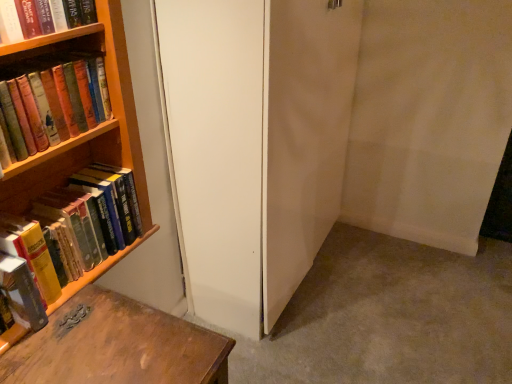
The width and height of the screenshot is (512, 384). What are the coordinates of `hardcover books at left, marked as the 3th book in a top-to-bottom arrangement` in the screenshot? It's located at (88, 215).

What do you see at coordinates (31, 19) in the screenshot? I see `hardcover book at upper left, which is the 4th book in bottom-to-top order` at bounding box center [31, 19].

What do you see at coordinates (55, 101) in the screenshot? This screenshot has width=512, height=384. I see `hardcover books at left, which appears as the 3th book when ordered from the bottom` at bounding box center [55, 101].

This screenshot has width=512, height=384. What are the coordinates of `white matte screen door at center` in the screenshot? It's located at (216, 152).

Image resolution: width=512 pixels, height=384 pixels. Describe the element at coordinates (216, 152) in the screenshot. I see `white matte screen door at center` at that location.

I want to click on hardcover book at left, positioned as the fourth book in top-to-bottom order, so click(22, 293).

Can you confirm if hardcover books at left, marked as the 2th book in a top-to-bottom arrangement, is smaller than hardcover books at left, which is the 2th book in bottom-to-top order?

Incorrect, hardcover books at left, marked as the 2th book in a top-to-bottom arrangement, is not smaller in size than hardcover books at left, which is the 2th book in bottom-to-top order.

Based on the photo, is hardcover books at left, which appears as the 3th book when ordered from the bottom, spatially inside hardcover books at left, which is the 2th book in bottom-to-top order, or outside of it?

hardcover books at left, which appears as the 3th book when ordered from the bottom, exists outside the volume of hardcover books at left, which is the 2th book in bottom-to-top order.

Can you confirm if hardcover books at left, which appears as the 3th book when ordered from the bottom, is positioned to the left of hardcover book at upper left, marked as the first book in a top-to-bottom arrangement?

Correct, you'll find hardcover books at left, which appears as the 3th book when ordered from the bottom, to the left of hardcover book at upper left, marked as the first book in a top-to-bottom arrangement.

Is hardcover books at left, which appears as the 3th book when ordered from the bottom, touching hardcover book at upper left, which is the 4th book in bottom-to-top order?

There is a gap between hardcover books at left, which appears as the 3th book when ordered from the bottom, and hardcover book at upper left, which is the 4th book in bottom-to-top order.

From the image's perspective, does hardcover books at left, which appears as the 3th book when ordered from the bottom, appear higher than hardcover book at upper left, marked as the first book in a top-to-bottom arrangement?

No, from the image's perspective, hardcover books at left, which appears as the 3th book when ordered from the bottom, is not over hardcover book at upper left, marked as the first book in a top-to-bottom arrangement.

Considering the points (251, 336) and (42, 30), which point is behind, point (251, 336) or point (42, 30)?

Positioned behind is point (251, 336).

From a real-world perspective, between white matte screen door at center and hardcover book at upper left, marked as the first book in a top-to-bottom arrangement, who is vertically lower?

In real-world perspective, white matte screen door at center is lower.

Considering the sizes of objects white matte screen door at center and hardcover book at upper left, which is the 4th book in bottom-to-top order, in the image provided, who is shorter, white matte screen door at center or hardcover book at upper left, which is the 4th book in bottom-to-top order,?

hardcover book at upper left, which is the 4th book in bottom-to-top order.

From the picture: Which object is closer to the camera, white matte screen door at center or hardcover book at upper left, marked as the first book in a top-to-bottom arrangement?

hardcover book at upper left, marked as the first book in a top-to-bottom arrangement, is more forward.

Would you say white matte screen door at center is a long distance from hardcover book at left, the first book in the bottom-to-top sequence?

No, white matte screen door at center is in close proximity to hardcover book at left, the first book in the bottom-to-top sequence.

In terms of height, does white matte screen door at center look taller or shorter compared to hardcover book at left, the first book in the bottom-to-top sequence?

white matte screen door at center is taller than hardcover book at left, the first book in the bottom-to-top sequence.

From the image's perspective, which one is positioned higher, white matte screen door at center or hardcover book at left, positioned as the fourth book in top-to-bottom order?

From the image's view, white matte screen door at center is above.

Could you measure the distance between white matte screen door at center and hardcover book at left, the first book in the bottom-to-top sequence?

white matte screen door at center is 26.77 inches from hardcover book at left, the first book in the bottom-to-top sequence.

From a real-world perspective, which object rests below the other?

From a 3D spatial view, white matte screen door at center is below.

From the image's perspective, is white matte screen door at center over hardcover books at left, marked as the 3th book in a top-to-bottom arrangement?

Correct, white matte screen door at center appears higher than hardcover books at left, marked as the 3th book in a top-to-bottom arrangement, in the image.

How many degrees apart are the facing directions of white matte screen door at center and hardcover books at left, marked as the 3th book in a top-to-bottom arrangement?

They differ by 0.0873 degrees in their facing directions.

How much distance is there between white matte screen door at center and hardcover books at left, which is the 2th book in bottom-to-top order?

They are 36.64 centimeters apart.

From a real-world perspective, relative to hardcover books at left, which appears as the 3th book when ordered from the bottom, is white matte screen door at center vertically above or below?

In terms of real-world spatial position, white matte screen door at center is below hardcover books at left, which appears as the 3th book when ordered from the bottom.

Is white matte screen door at center spatially inside hardcover books at left, which appears as the 3th book when ordered from the bottom, or outside of it?

white matte screen door at center is spatially situated outside hardcover books at left, which appears as the 3th book when ordered from the bottom.

Between white matte screen door at center and hardcover books at left, which appears as the 3th book when ordered from the bottom, which one has more height?

Standing taller between the two is white matte screen door at center.

Starting from the white matte screen door at center, which book is the 3rd one in front? Please provide its 2D coordinates.

[(55, 101)]

Does point (33, 305) come closer to viewer compared to point (8, 29)?

That is False.

Does hardcover book at left, positioned as the fourth book in top-to-bottom order, appear on the right side of hardcover book at upper left, which is the 4th book in bottom-to-top order?

No.

The image size is (512, 384). There is a hardcover book at left, positioned as the fourth book in top-to-bottom order. Identify the location of the 3rd book above it (from a real-world perspective). (31, 19).

Where is `the 3rd book in front of the hardcover books at left, marked as the 3th book in a top-to-bottom arrangement`? the 3rd book in front of the hardcover books at left, marked as the 3th book in a top-to-bottom arrangement is located at coordinates (55, 101).

The height and width of the screenshot is (384, 512). I want to click on the 1st book behind the hardcover books at left, which appears as the 3th book when ordered from the bottom, counting from the anchor's position, so click(31, 19).

Considering their positions, is hardcover book at upper left, marked as the first book in a top-to-bottom arrangement, positioned further to white matte screen door at center than hardcover books at left, which is the 2th book in bottom-to-top order?

hardcover book at upper left, marked as the first book in a top-to-bottom arrangement, lies further to white matte screen door at center than the other object.

Considering their positions, is hardcover books at left, marked as the 3th book in a top-to-bottom arrangement, positioned closer to hardcover book at left, positioned as the fourth book in top-to-bottom order, than hardcover books at left, marked as the 2th book in a top-to-bottom arrangement?

Among the two, hardcover books at left, marked as the 3th book in a top-to-bottom arrangement, is located nearer to hardcover book at left, positioned as the fourth book in top-to-bottom order.

Based on their spatial positions, is hardcover books at left, marked as the 2th book in a top-to-bottom arrangement, or hardcover book at left, positioned as the fourth book in top-to-bottom order, closer to white matte screen door at center?

The object closer to white matte screen door at center is hardcover books at left, marked as the 2th book in a top-to-bottom arrangement.

Based on their spatial positions, is hardcover books at left, marked as the 3th book in a top-to-bottom arrangement, or hardcover book at left, the first book in the bottom-to-top sequence, further from hardcover book at upper left, which is the 4th book in bottom-to-top order?

hardcover book at left, the first book in the bottom-to-top sequence, is further to hardcover book at upper left, which is the 4th book in bottom-to-top order.

Considering their positions, is hardcover books at left, marked as the 2th book in a top-to-bottom arrangement, positioned further to hardcover book at upper left, marked as the first book in a top-to-bottom arrangement, than hardcover books at left, marked as the 3th book in a top-to-bottom arrangement?

hardcover books at left, marked as the 3th book in a top-to-bottom arrangement, is further to hardcover book at upper left, marked as the first book in a top-to-bottom arrangement.

From the image, which object appears to be nearer to hardcover book at left, the first book in the bottom-to-top sequence, hardcover book at upper left, which is the 4th book in bottom-to-top order, or hardcover books at left, which appears as the 3th book when ordered from the bottom?

hardcover books at left, which appears as the 3th book when ordered from the bottom, is closer to hardcover book at left, the first book in the bottom-to-top sequence.

Consider the image. Looking at the image, which one is located further to hardcover book at left, positioned as the fourth book in top-to-bottom order, white matte screen door at center or hardcover books at left, marked as the 2th book in a top-to-bottom arrangement?

white matte screen door at center.

Based on their spatial positions, is hardcover books at left, marked as the 3th book in a top-to-bottom arrangement, or hardcover books at left, which appears as the 3th book when ordered from the bottom, further from hardcover book at upper left, marked as the first book in a top-to-bottom arrangement?

hardcover books at left, marked as the 3th book in a top-to-bottom arrangement, lies further to hardcover book at upper left, marked as the first book in a top-to-bottom arrangement, than the other object.

The height and width of the screenshot is (384, 512). I want to click on book between hardcover book at upper left, which is the 4th book in bottom-to-top order, and hardcover books at left, marked as the 3th book in a top-to-bottom arrangement, from top to bottom, so click(x=55, y=101).

The height and width of the screenshot is (384, 512). Find the location of `book between hardcover book at upper left, marked as the first book in a top-to-bottom arrangement, and white matte screen door at center from left to right`. book between hardcover book at upper left, marked as the first book in a top-to-bottom arrangement, and white matte screen door at center from left to right is located at coordinates (88, 215).

Locate an element on the screen. The width and height of the screenshot is (512, 384). book that lies between hardcover books at left, which appears as the 3th book when ordered from the bottom, and hardcover book at left, positioned as the fourth book in top-to-bottom order, from top to bottom is located at coordinates (88, 215).